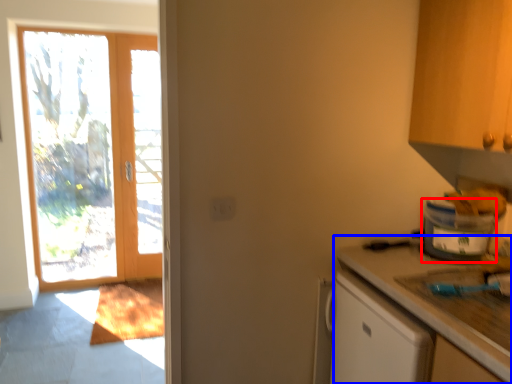
Question: Which point is further to the camera, appliance (highlighted by a red box) or countertop (highlighted by a blue box)?

Choices:
 (A) appliance
 (B) countertop

Answer: (A)